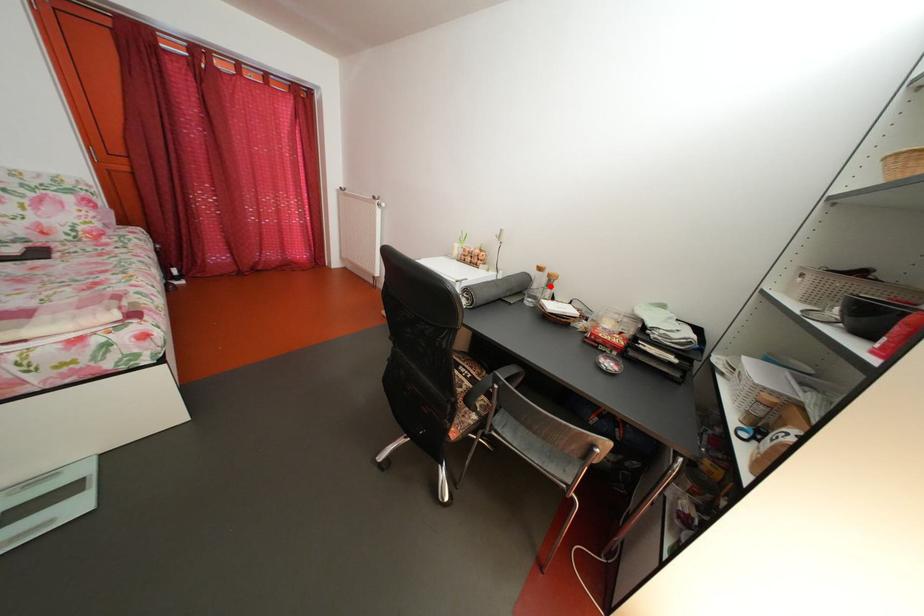
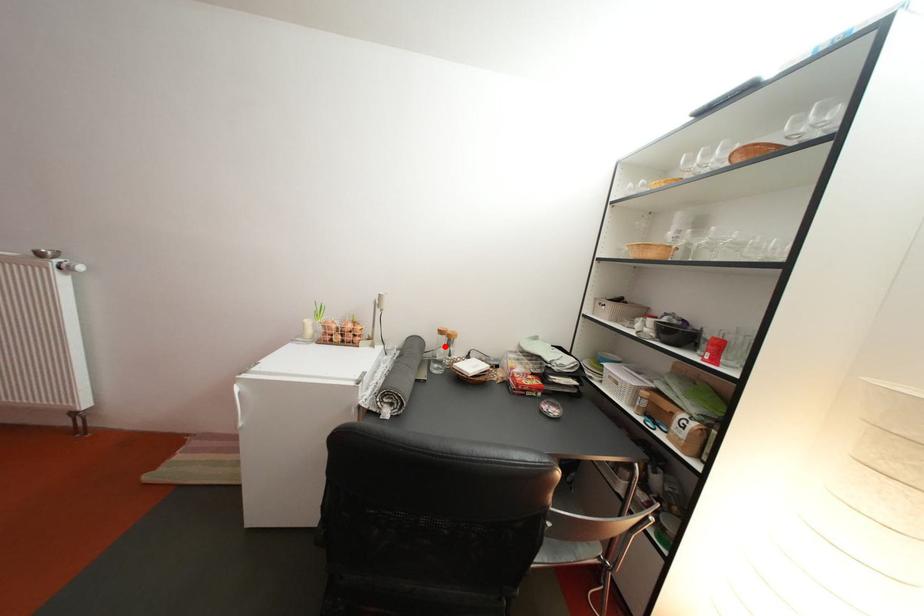
I am providing you with two images of the same scene from different viewpoints. A red point is marked on the first image and another point is marked on the second image. Is the red point in image1 aligned with the point shown in image2?

Yes